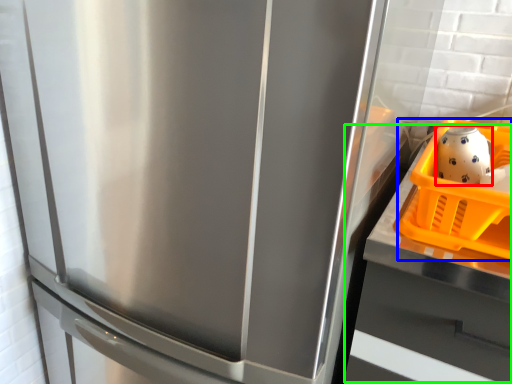
Question: Which object is positioned closest to tea pot (highlighted by a red box)? Select from basket (highlighted by a blue box) and counter top (highlighted by a green box).

Choices:
 (A) basket
 (B) counter top

Answer: (A)